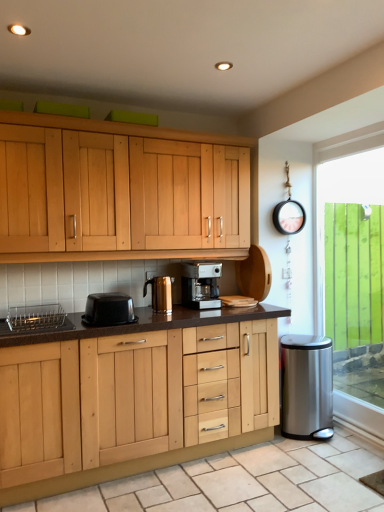
Question: Is black plastic container at center, which ranks as the first kitchen appliance in left-to-right order, wider or thinner than stainless steel trash can at right, marked as the 1th appliance in a back-to-front arrangement?

Choices:
 (A) thin
 (B) wide

Answer: (A)

Question: Visually, is black plastic container at center, placed as the 2th kitchen appliance when sorted from right to left, positioned to the left or to the right of stainless steel trash can at right, placed as the second appliance when sorted from top to bottom?

Choices:
 (A) left
 (B) right

Answer: (A)

Question: Based on their relative distances, which object is nearer to the metallic silver kettle at center, marked as the second kitchen appliance in a left-to-right arrangement?

Choices:
 (A) stainless steel trash can at right, marked as the 1th appliance in a back-to-front arrangement
 (B) green glass window at right
 (C) black plastic container at center, which ranks as the first kitchen appliance in left-to-right order
 (D) silver metallic dish rack at lower left, marked as the 2th appliance in a bottom-to-top arrangement
 (E) beige tile at lower center

Answer: (C)

Question: Estimate the real-world distances between objects in this image. Which object is farther from the satin silver coffee maker at center?

Choices:
 (A) black plastic container at center, placed as the 2th kitchen appliance when sorted from right to left
 (B) stainless steel trash can at right, placed as the second appliance when sorted from top to bottom
 (C) metallic silver kettle at center, which is the 2th kitchen appliance in front-to-back order
 (D) silver metallic dish rack at lower left, positioned as the first appliance in top-to-bottom order
 (E) beige tile at lower center

Answer: (E)